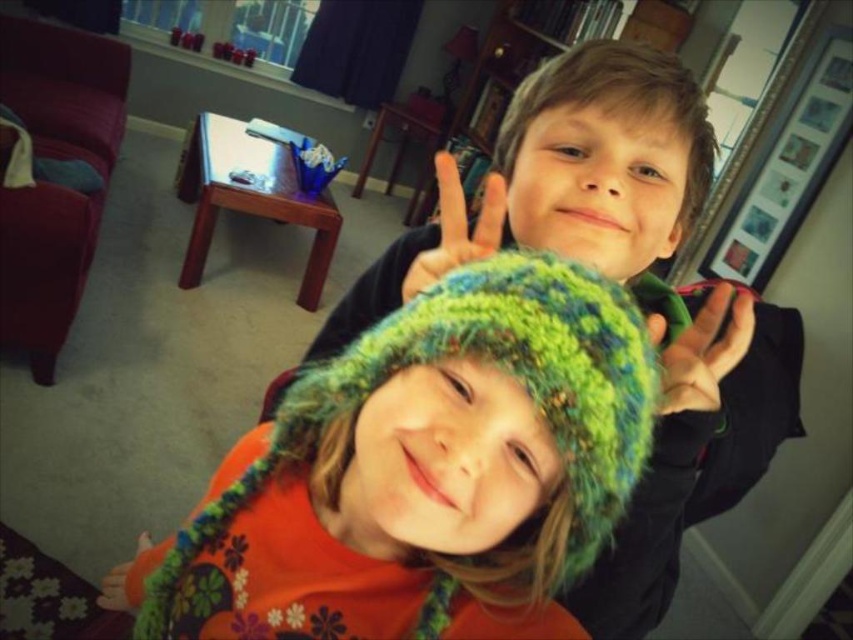
Question: Among these points, which one is farthest from the camera?

Choices:
 (A) (636, 556)
 (B) (699, 344)
 (C) (109, 580)

Answer: (C)

Question: From the image, what is the correct spatial relationship of knitted green hat at center in relation to fluffy orange sweater at lower left?

Choices:
 (A) above
 (B) below

Answer: (A)

Question: Is knitted green hat at center smaller than green knitted glove at upper right?

Choices:
 (A) yes
 (B) no

Answer: (B)

Question: Which object appears closest to the camera in this image?

Choices:
 (A) knitted green hat at center
 (B) matte green knitted hat at center

Answer: (A)

Question: Does matte green knitted hat at center have a larger size compared to green knitted glove at upper right?

Choices:
 (A) no
 (B) yes

Answer: (B)

Question: Which of the following is the farthest from the observer?

Choices:
 (A) knitted green hat at center
 (B) fluffy orange sweater at lower left
 (C) matte green knitted hat at center

Answer: (B)